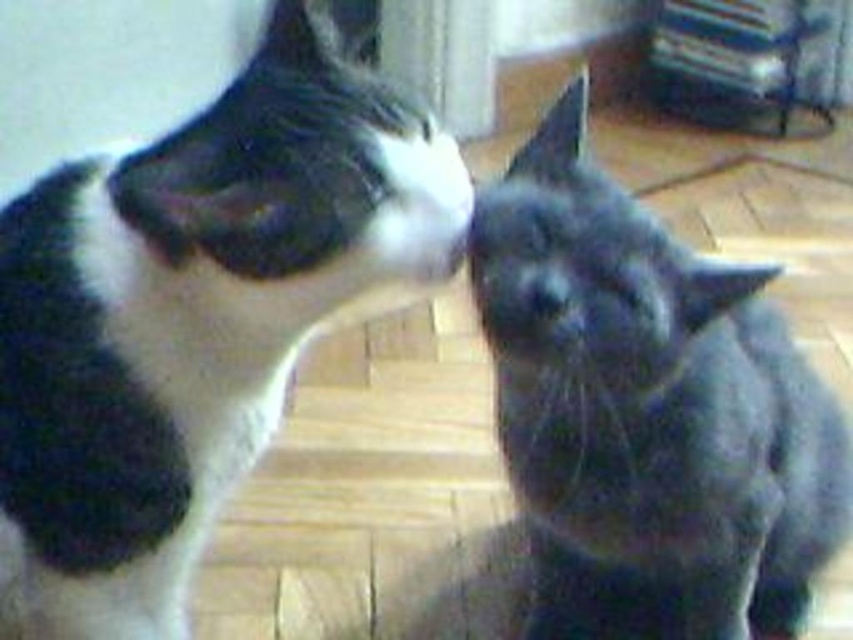
Is black and white fur cat at left to the right of gray fluffy cat at right from the viewer's perspective?

Incorrect, black and white fur cat at left is not on the right side of gray fluffy cat at right.

Can you confirm if black and white fur cat at left is positioned to the left of gray fluffy cat at right?

Yes, black and white fur cat at left is to the left of gray fluffy cat at right.

Where is `black and white fur cat at left`? The width and height of the screenshot is (853, 640). black and white fur cat at left is located at coordinates (195, 317).

Who is lower down, gray fluffy cat at right or soft fur cat at upper left?

gray fluffy cat at right is lower down.

From the picture: Measure the distance between gray fluffy cat at right and camera.

A: gray fluffy cat at right and camera are 3.40 feet apart.

Which is in front, point (662, 275) or point (90, 106)?

Point (662, 275) is in front.

The image size is (853, 640). Find the location of `gray fluffy cat at right`. gray fluffy cat at right is located at coordinates (648, 412).

Between point (252, 394) and point (552, 305), which one is positioned behind?

The point (252, 394) is more distant.

Which of these two, black and white fur cat at left or gray matte nose at center, stands shorter?

gray matte nose at center is shorter.

Which is in front, point (271, 212) or point (532, 304)?

Point (271, 212)

I want to click on black and white fur cat at left, so click(x=195, y=317).